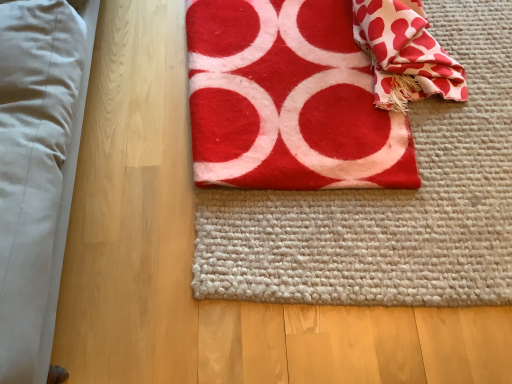
Question: Is red felt towel at center at the right side of white textured fabric at upper right?

Choices:
 (A) no
 (B) yes

Answer: (A)

Question: Considering the relative sizes of red felt towel at center and white textured fabric at upper right in the image provided, is red felt towel at center thinner than white textured fabric at upper right?

Choices:
 (A) no
 (B) yes

Answer: (A)

Question: Does red felt towel at center lie behind white textured fabric at upper right?

Choices:
 (A) yes
 (B) no

Answer: (B)

Question: Is white textured fabric at upper right surrounded by red felt towel at center?

Choices:
 (A) yes
 (B) no

Answer: (A)

Question: Can you confirm if red felt towel at center is bigger than white textured fabric at upper right?

Choices:
 (A) no
 (B) yes

Answer: (B)

Question: Considering the positions of red felt towel at center and red felt yoga mat at center in the image, is red felt towel at center bigger or smaller than red felt yoga mat at center?

Choices:
 (A) small
 (B) big

Answer: (B)

Question: From the image's perspective, relative to red felt yoga mat at center, is red felt towel at center above or below?

Choices:
 (A) above
 (B) below

Answer: (A)

Question: Visually, is red felt towel at center positioned to the left or to the right of red felt yoga mat at center?

Choices:
 (A) right
 (B) left

Answer: (B)

Question: Is red felt towel at center situated inside red felt yoga mat at center or outside?

Choices:
 (A) inside
 (B) outside

Answer: (B)

Question: From a real-world perspective, is red felt yoga mat at center positioned above or below red felt towel at center?

Choices:
 (A) above
 (B) below

Answer: (B)

Question: From their relative heights in the image, would you say red felt yoga mat at center is taller or shorter than red felt towel at center?

Choices:
 (A) short
 (B) tall

Answer: (A)

Question: Considering the positions of red felt yoga mat at center and red felt towel at center in the image, is red felt yoga mat at center wider or thinner than red felt towel at center?

Choices:
 (A) thin
 (B) wide

Answer: (B)

Question: From the image's perspective, is red felt yoga mat at center positioned above or below red felt towel at center?

Choices:
 (A) below
 (B) above

Answer: (A)

Question: Which is correct: red felt towel at center is inside white textured fabric at upper right, or outside of it?

Choices:
 (A) outside
 (B) inside

Answer: (A)

Question: From a real-world perspective, relative to white textured fabric at upper right, is red felt towel at center vertically above or below?

Choices:
 (A) above
 (B) below

Answer: (B)